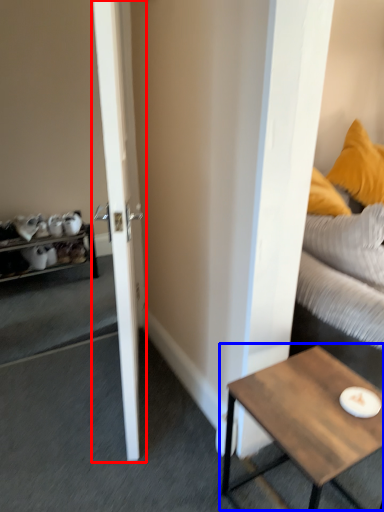
Question: Among these objects, which one is farthest to the camera, door (highlighted by a red box) or coffee table (highlighted by a blue box)?

Choices:
 (A) door
 (B) coffee table

Answer: (B)